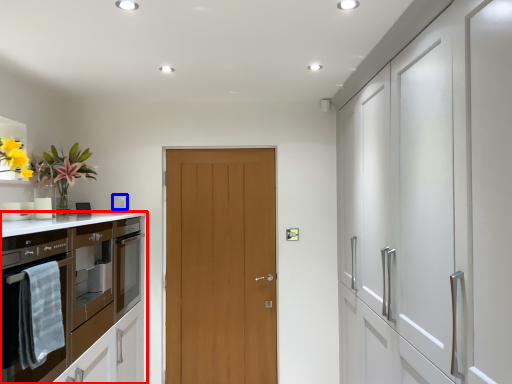
Question: Which object appears farthest to the camera in this image, cabinetry (highlighted by a red box) or appliance (highlighted by a blue box)?

Choices:
 (A) cabinetry
 (B) appliance

Answer: (B)